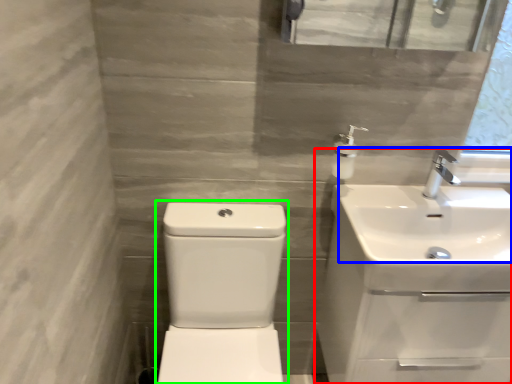
Question: Based on their relative distances, which object is farther from sink (highlighted by a red box)? Choose from sink (highlighted by a blue box) and sink (highlighted by a green box).

Choices:
 (A) sink
 (B) sink

Answer: (B)